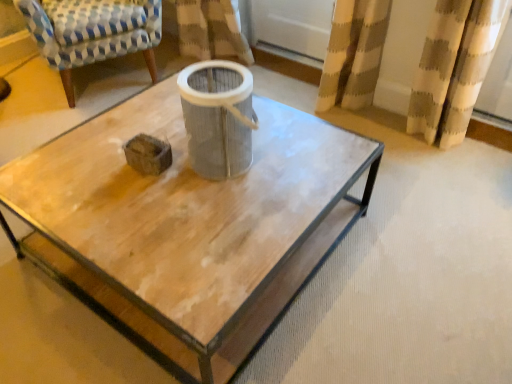
Question: Are wooden coffee table at center and blue and white checkered fabric armchair at upper left beside each other?

Choices:
 (A) no
 (B) yes

Answer: (A)

Question: Is wooden coffee table at center facing away from blue and white checkered fabric armchair at upper left?

Choices:
 (A) yes
 (B) no

Answer: (B)

Question: Is wooden coffee table at center wider than blue and white checkered fabric armchair at upper left?

Choices:
 (A) yes
 (B) no

Answer: (A)

Question: Does wooden coffee table at center have a smaller size compared to blue and white checkered fabric armchair at upper left?

Choices:
 (A) no
 (B) yes

Answer: (A)

Question: From the image's perspective, is wooden coffee table at center on top of blue and white checkered fabric armchair at upper left?

Choices:
 (A) yes
 (B) no

Answer: (B)

Question: From a real-world perspective, is wooden coffee table at center positioned above or below gray fabric filter at center?

Choices:
 (A) above
 (B) below

Answer: (B)

Question: Do you think wooden coffee table at center is within gray fabric filter at center, or outside of it?

Choices:
 (A) outside
 (B) inside

Answer: (A)

Question: Is wooden coffee table at center taller or shorter than gray fabric filter at center?

Choices:
 (A) tall
 (B) short

Answer: (B)

Question: Considering the positions of wooden coffee table at center and gray fabric filter at center in the image, is wooden coffee table at center wider or thinner than gray fabric filter at center?

Choices:
 (A) thin
 (B) wide

Answer: (B)

Question: Considering the positions of point tap(105, 150) and point tap(52, 41), is point tap(105, 150) closer or farther from the camera than point tap(52, 41)?

Choices:
 (A) closer
 (B) farther

Answer: (A)

Question: Is wooden coffee table at center in front of or behind blue and white checkered fabric armchair at upper left in the image?

Choices:
 (A) behind
 (B) front

Answer: (B)

Question: Choose the correct answer: Is wooden coffee table at center inside blue and white checkered fabric armchair at upper left or outside it?

Choices:
 (A) inside
 (B) outside

Answer: (B)

Question: Looking at their shapes, would you say wooden coffee table at center is wider or thinner than blue and white checkered fabric armchair at upper left?

Choices:
 (A) thin
 (B) wide

Answer: (B)

Question: In the image, is gray fabric filter at center positioned in front of or behind wooden coffee table at center?

Choices:
 (A) behind
 (B) front

Answer: (A)

Question: From the image's perspective, is gray fabric filter at center above or below wooden coffee table at center?

Choices:
 (A) above
 (B) below

Answer: (A)